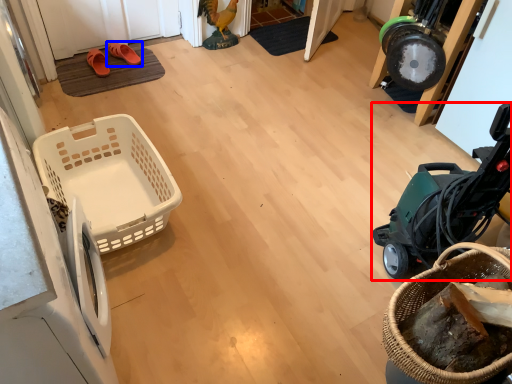
Question: Which object is closer to the camera taking this photo, baby carriage (highlighted by a red box) or footwear (highlighted by a blue box)?

Choices:
 (A) baby carriage
 (B) footwear

Answer: (A)